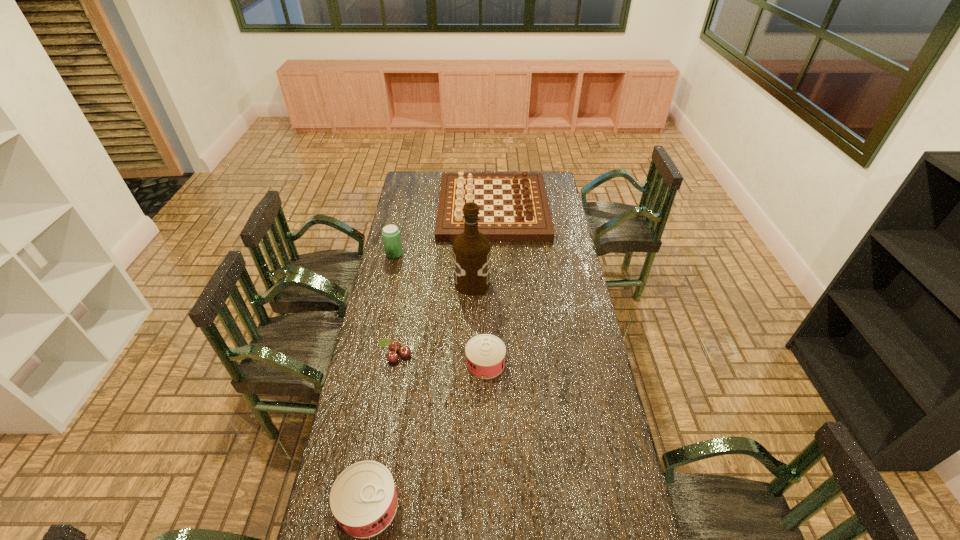
This screenshot has width=960, height=540. Identify the location of vacant place for an extra can on the right. (560, 272).